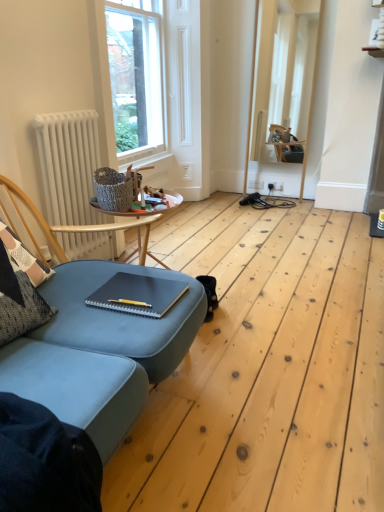
Question: Considering the relative sizes of white matte radiator at left and clear glass window at upper center in the image provided, is white matte radiator at left smaller than clear glass window at upper center?

Choices:
 (A) no
 (B) yes

Answer: (B)

Question: Considering the relative positions of white matte radiator at left and clear glass window at upper center in the image provided, is white matte radiator at left to the right of clear glass window at upper center from the viewer's perspective?

Choices:
 (A) yes
 (B) no

Answer: (B)

Question: Is white matte radiator at left not inside clear glass window at upper center?

Choices:
 (A) no
 (B) yes

Answer: (B)

Question: From a real-world perspective, is white matte radiator at left beneath clear glass window at upper center?

Choices:
 (A) no
 (B) yes

Answer: (B)

Question: Could clear glass window at upper center be considered to be inside white matte radiator at left?

Choices:
 (A) yes
 (B) no

Answer: (B)

Question: Is white matte radiator at left far from clear glass window at upper center?

Choices:
 (A) no
 (B) yes

Answer: (B)

Question: Is the position of clear glass window at upper center less distant than that of white matte radiator at left?

Choices:
 (A) yes
 (B) no

Answer: (B)

Question: Considering the relative sizes of clear glass window at upper center and white matte radiator at left in the image provided, is clear glass window at upper center wider than white matte radiator at left?

Choices:
 (A) yes
 (B) no

Answer: (A)

Question: Is the depth of clear glass window at upper center greater than that of white matte radiator at left?

Choices:
 (A) no
 (B) yes

Answer: (B)

Question: Can you confirm if clear glass window at upper center is thinner than white matte radiator at left?

Choices:
 (A) no
 (B) yes

Answer: (A)

Question: From a real-world perspective, does clear glass window at upper center stand above white matte radiator at left?

Choices:
 (A) yes
 (B) no

Answer: (A)

Question: Is clear glass window at upper center aimed at white matte radiator at left?

Choices:
 (A) yes
 (B) no

Answer: (B)

Question: Is matte black notebook at center placed right next to white matte radiator at left?

Choices:
 (A) yes
 (B) no

Answer: (B)